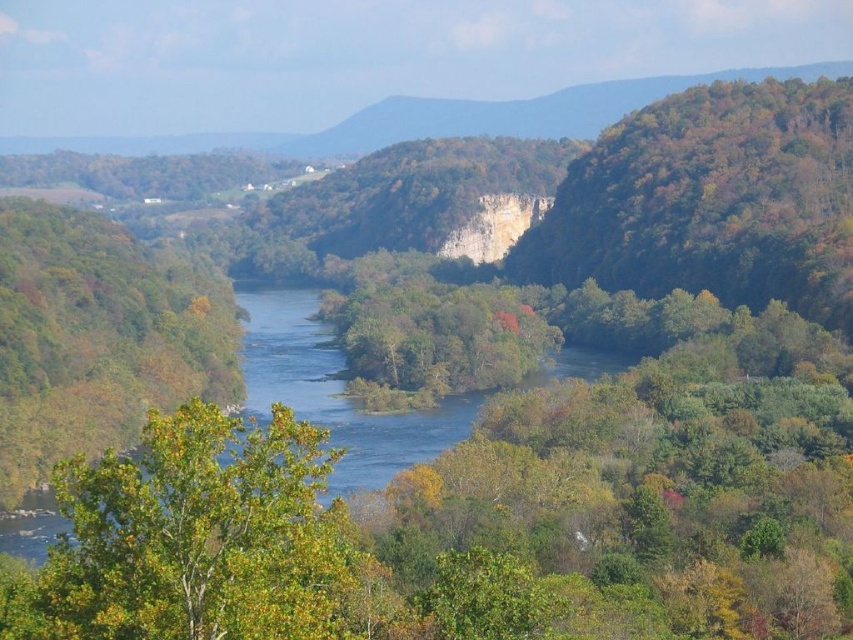
Question: Which of the following is the closest to the observer?

Choices:
 (A) (694, 144)
 (B) (519, 296)

Answer: (B)

Question: Based on their relative distances, which object is farther from the green leafy tree at lower left?

Choices:
 (A) green leafy tree at left
 (B) green leafy tree at right

Answer: (B)

Question: Does green leafy tree at right have a smaller size compared to green leafy trees at center?

Choices:
 (A) yes
 (B) no

Answer: (B)

Question: Which point is closer to the camera?

Choices:
 (A) green leafy trees at center
 (B) green leafy tree at right
 (C) green leafy tree at lower left
 (D) green leafy tree at left

Answer: (C)

Question: Does green leafy tree at lower left appear on the left side of green leafy trees at center?

Choices:
 (A) yes
 (B) no

Answer: (A)

Question: Can you confirm if green leafy tree at right is bigger than green leafy trees at center?

Choices:
 (A) yes
 (B) no

Answer: (A)